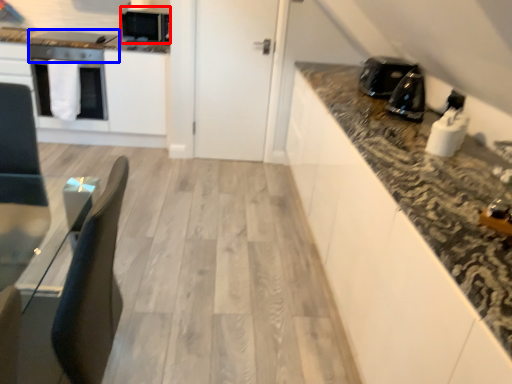
Question: Which of the following is the farthest to the observer, appliance (highlighted by a red box) or appliance (highlighted by a blue box)?

Choices:
 (A) appliance
 (B) appliance

Answer: (A)